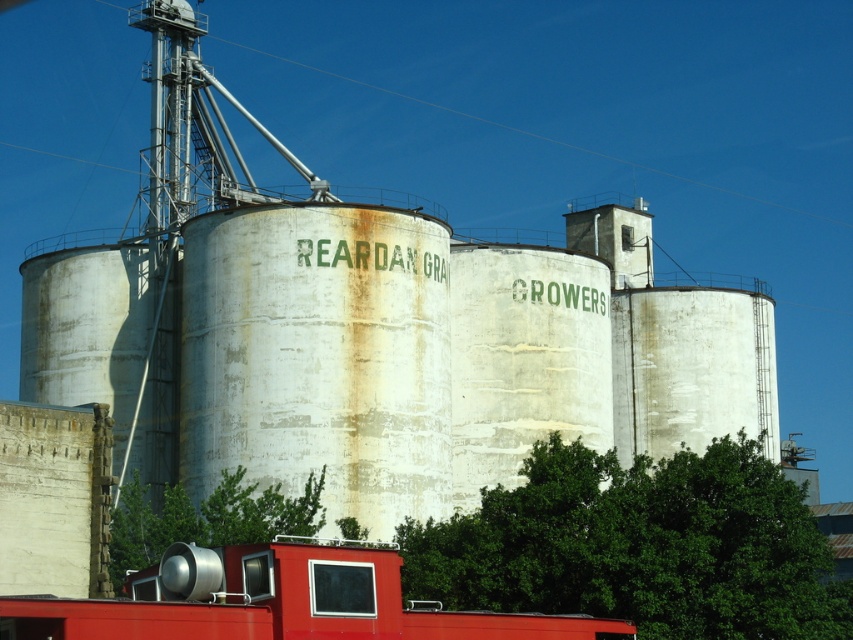
Who is more forward, (344, 604) or (195, 534)?

Point (344, 604) is in front.

Does metallic trailer truck at lower center appear on the right side of green leafy tree at lower center?

Yes, metallic trailer truck at lower center is to the right of green leafy tree at lower center.

Where is `metallic trailer truck at lower center`? The width and height of the screenshot is (853, 640). metallic trailer truck at lower center is located at coordinates (277, 602).

Find the location of `metallic trailer truck at lower center`. metallic trailer truck at lower center is located at coordinates (277, 602).

Does green leafy tree at center appear over green leafy tree at lower center?

No.

The height and width of the screenshot is (640, 853). Describe the element at coordinates (639, 547) in the screenshot. I see `green leafy tree at center` at that location.

Locate an element on the screen. green leafy tree at center is located at coordinates (639, 547).

Does green leafy tree at center have a larger size compared to metallic trailer truck at lower center?

Yes, green leafy tree at center is bigger than metallic trailer truck at lower center.

From the picture: Is green leafy tree at center above metallic trailer truck at lower center?

Incorrect, green leafy tree at center is not positioned above metallic trailer truck at lower center.

Which is in front, point (555, 595) or point (173, 608)?

Point (173, 608)

At what (x,y) coordinates should I click in order to perform the action: click on green leafy tree at center. Please return your answer as a coordinate pair (x, y). This screenshot has width=853, height=640. Looking at the image, I should click on pos(639,547).